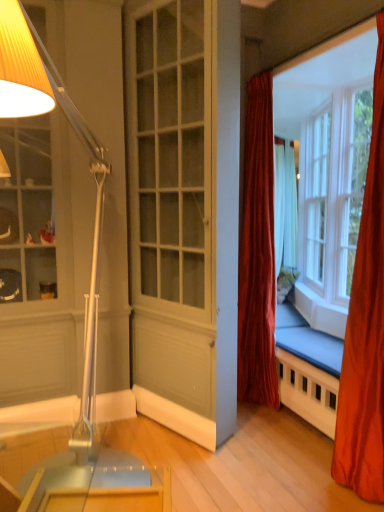
Question: Is velvet red curtain at center, the 2th curtain when ordered from right to left, not near clear glass window at upper right?

Choices:
 (A) no
 (B) yes

Answer: (A)

Question: Is velvet red curtain at center, placed as the first curtain when sorted from back to front, positioned in front of clear glass window at upper right?

Choices:
 (A) yes
 (B) no

Answer: (A)

Question: Considering the relative sizes of velvet red curtain at center, the 2th curtain when ordered from right to left, and clear glass window at upper right in the image provided, is velvet red curtain at center, the 2th curtain when ordered from right to left, wider than clear glass window at upper right?

Choices:
 (A) no
 (B) yes

Answer: (A)

Question: Does velvet red curtain at center, the 2th curtain when ordered from front to back, have a smaller size compared to clear glass window at upper right?

Choices:
 (A) no
 (B) yes

Answer: (B)

Question: From a real-world perspective, is velvet red curtain at center, placed as the first curtain when sorted from back to front, beneath clear glass window at upper right?

Choices:
 (A) no
 (B) yes

Answer: (B)

Question: From a real-world perspective, is silky orange curtain at right, which is counted as the 2th curtain, starting from the left, above or below metallic silver lamp at left?

Choices:
 (A) below
 (B) above

Answer: (B)

Question: From the image's perspective, is silky orange curtain at right, which is counted as the 2th curtain, starting from the left, positioned above or below metallic silver lamp at left?

Choices:
 (A) below
 (B) above

Answer: (B)

Question: Considering the positions of silky orange curtain at right, which is counted as the 2th curtain, starting from the left, and metallic silver lamp at left in the image, is silky orange curtain at right, which is counted as the 2th curtain, starting from the left, taller or shorter than metallic silver lamp at left?

Choices:
 (A) tall
 (B) short

Answer: (A)

Question: Based on their sizes in the image, would you say silky orange curtain at right, arranged as the first curtain when viewed from the front, is bigger or smaller than metallic silver lamp at left?

Choices:
 (A) small
 (B) big

Answer: (A)

Question: Considering the positions of velvet red curtain at center, placed as the first curtain when sorted from back to front, and clear glass window at upper right in the image, is velvet red curtain at center, placed as the first curtain when sorted from back to front, wider or thinner than clear glass window at upper right?

Choices:
 (A) thin
 (B) wide

Answer: (A)

Question: From their relative heights in the image, would you say velvet red curtain at center, positioned as the 1th curtain in left-to-right order, is taller or shorter than clear glass window at upper right?

Choices:
 (A) tall
 (B) short

Answer: (A)

Question: From the image's perspective, relative to clear glass window at upper right, is velvet red curtain at center, the 2th curtain when ordered from right to left, above or below?

Choices:
 (A) below
 (B) above

Answer: (A)

Question: In terms of size, does velvet red curtain at center, placed as the first curtain when sorted from back to front, appear bigger or smaller than clear glass window at upper right?

Choices:
 (A) big
 (B) small

Answer: (B)

Question: From a real-world perspective, relative to clear glass window at upper right, is white painted wood screen door at center vertically above or below?

Choices:
 (A) above
 (B) below

Answer: (B)

Question: Is white painted wood screen door at center situated inside clear glass window at upper right or outside?

Choices:
 (A) outside
 (B) inside

Answer: (A)